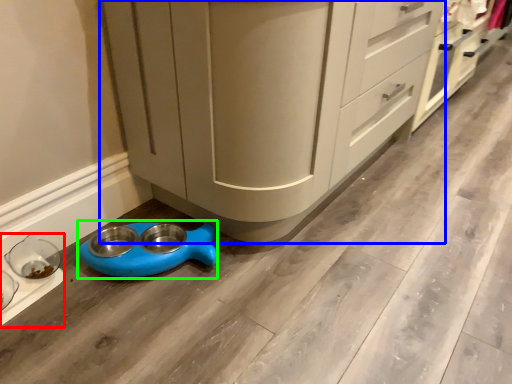
Question: Based on their relative distances, which object is nearer to appliance (highlighted by a red box)? Choose from cabinetry (highlighted by a blue box) and appliance (highlighted by a green box).

Choices:
 (A) cabinetry
 (B) appliance

Answer: (B)